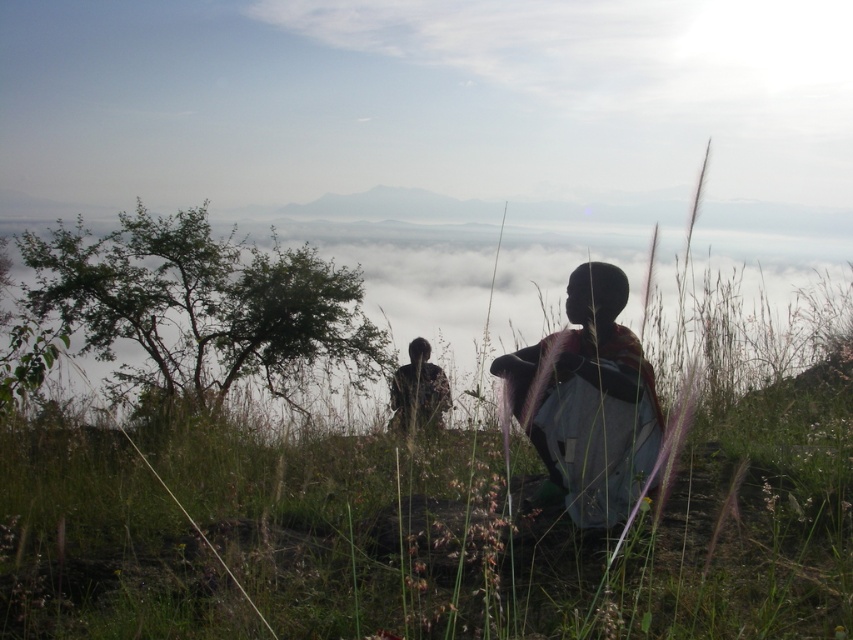
From the picture: You are a photographer setting up a shot of the two figures on the hilltop. You need to adjust your focus so that the silhouette fabric at center and the dark brown leather jacket at center are both in sharp focus. Which object should you focus on to ensure both are in focus?

You should focus on the dark brown leather jacket at center because it is closer to the camera than the silhouette fabric at center, which is further away. Focusing on the closer object ensures both will be in focus.